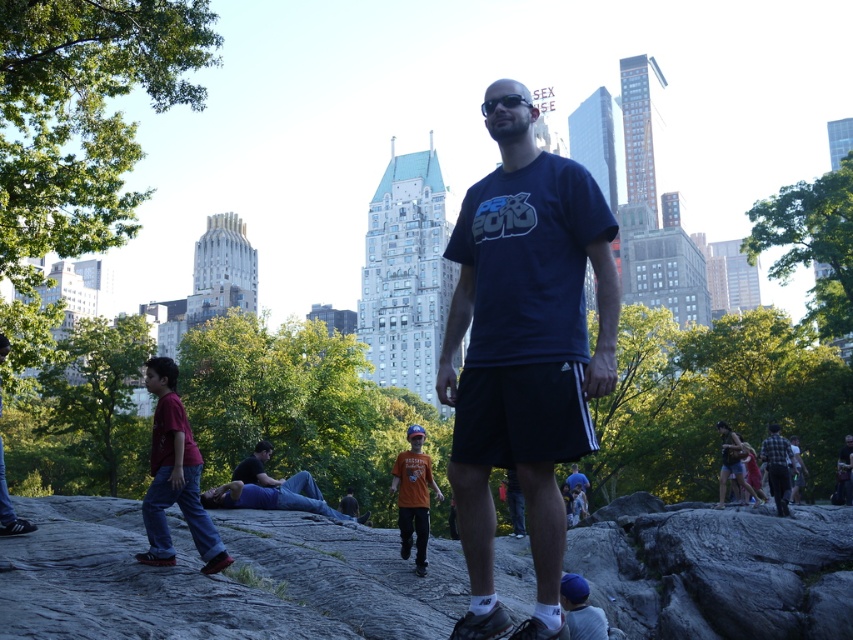
Question: Which of the following is the farthest from the observer?

Choices:
 (A) (244, 472)
 (B) (503, 392)
 (C) (720, 480)

Answer: (C)

Question: Which point is farther to the camera?

Choices:
 (A) (751, 490)
 (B) (231, 476)
 (C) (785, 486)

Answer: (B)

Question: Does navy blue t-shirt at center have a smaller size compared to matte red shirt at left?

Choices:
 (A) no
 (B) yes

Answer: (A)

Question: Is flannel shirt at right to the right of dark blue shirt at center from the viewer's perspective?

Choices:
 (A) yes
 (B) no

Answer: (A)

Question: Is the position of matte red shirt at left more distant than that of matte black shorts at lower right?

Choices:
 (A) yes
 (B) no

Answer: (B)

Question: Which is farther from the matte red shirt at left?

Choices:
 (A) dark blue shirt at center
 (B) matte black shorts at lower right
 (C) flannel shirt at right
 (D) navy blue t-shirt at center

Answer: (C)